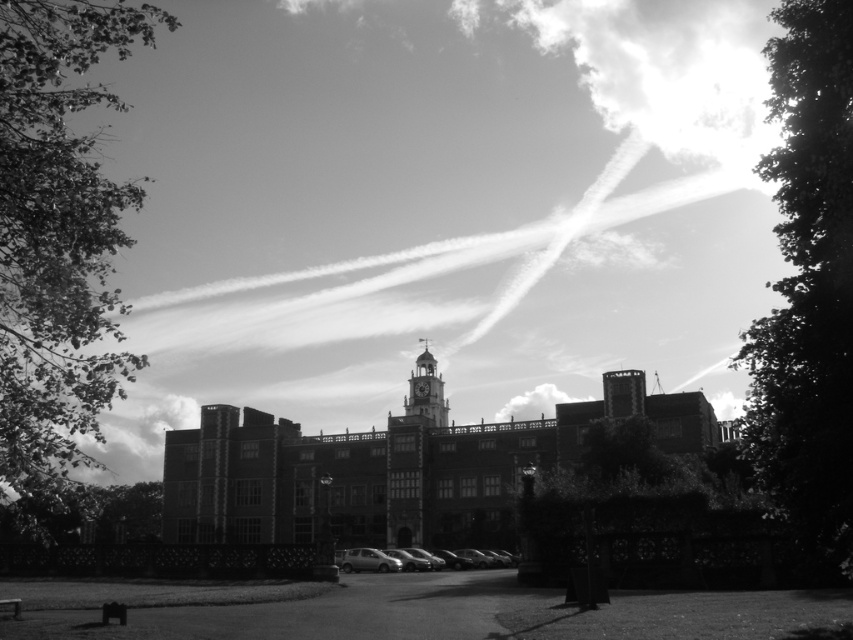
You are standing in front of the grand historic building. There is a point marked at coordinates [426,392]. What architectural feature does this point correspond to?

The point at coordinates [426,392] corresponds to the smooth stone clock tower at center.

You are a photographer planning to capture a wide shot of the historic building with its clock tower. You notice a silhouette leafy tree at right and a metallic silver car at center in the frame. Which object should you adjust your composition to avoid obstructing the clock tower?

The silhouette leafy tree at right is larger in size than the metallic silver car at center, so you should adjust the composition to avoid the silhouette leafy tree at right as it is bigger and more likely to obstruct the clock tower.

You are standing in front of the historic building and want to take a photo that includes both the silhouette leafy tree at right and the dark green leafy tree at center. Which tree should you position closer to the camera to ensure both are in focus?

You should position the silhouette leafy tree at right closer to the camera because it is already closer to the viewer than the dark green leafy tree at center, allowing both to be in focus when framed properly.